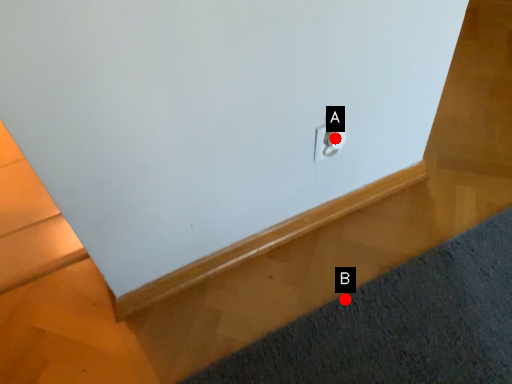
Question: Two points are circled on the image, labeled by A and B beside each circle. Among these points, which one is farthest from the camera?

Choices:
 (A) A is further
 (B) B is further

Answer: (B)